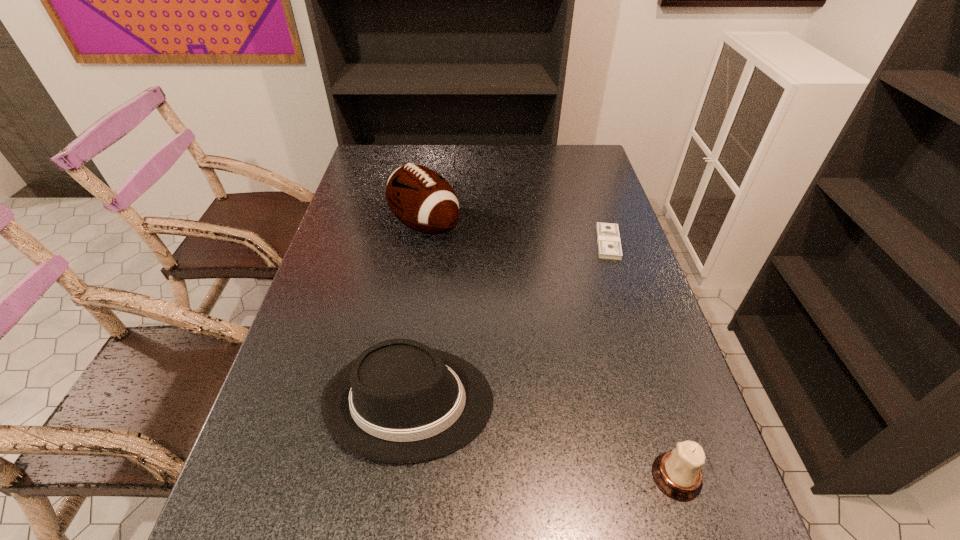
The width and height of the screenshot is (960, 540). I want to click on football (American), so click(420, 198).

Image resolution: width=960 pixels, height=540 pixels. I want to click on fedora, so click(400, 401).

The height and width of the screenshot is (540, 960). Find the location of `the second shortest object`. the second shortest object is located at coordinates (678, 474).

Where is `the shortest object`? the shortest object is located at coordinates (609, 245).

The width and height of the screenshot is (960, 540). What are the coordinates of `vacant space located on the right of the football (American)` in the screenshot? It's located at (535, 226).

Find the location of `vacant space located 0.310m on the front-facing side of the fedora`. vacant space located 0.310m on the front-facing side of the fedora is located at coordinates (638, 401).

Locate an element on the screen. Image resolution: width=960 pixels, height=540 pixels. vacant space located 0.310m on the back of the candle holder is located at coordinates (631, 329).

What are the coordinates of `vacant space located 0.300m on the left of the dollar` in the screenshot? It's located at (494, 242).

I want to click on football (American) situated at the left edge, so click(x=420, y=198).

Identify the location of fedora that is positioned at the left edge. The height and width of the screenshot is (540, 960). (400, 401).